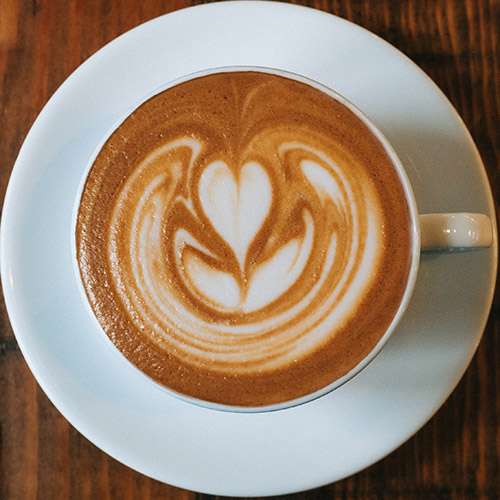
The height and width of the screenshot is (500, 500). In order to click on table in this screenshot , I will do `click(20, 29)`.